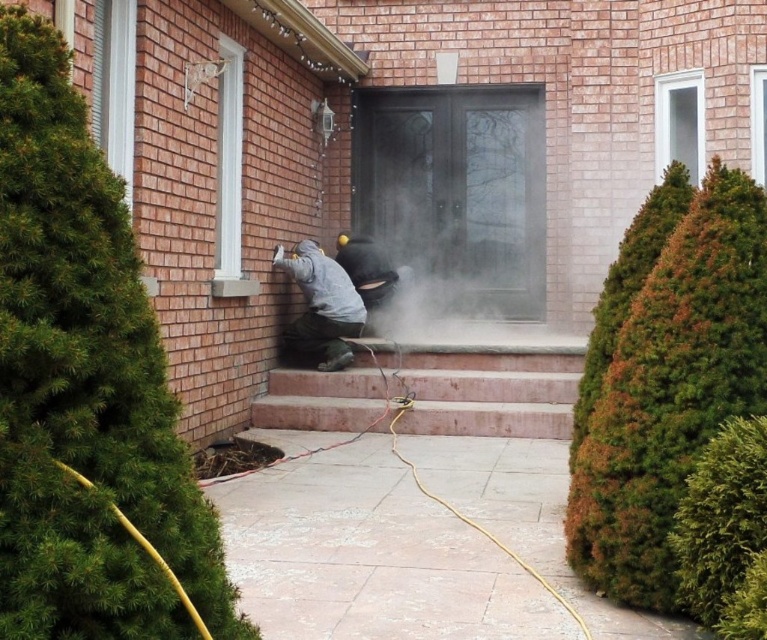
Is point (443, 410) positioned behind point (321, 333)?

No, it is not.

Does pink concrete stairs at center have a smaller size compared to gray matte jacket at center?

Actually, pink concrete stairs at center might be larger than gray matte jacket at center.

Locate an element on the screen. The image size is (767, 640). pink concrete stairs at center is located at coordinates (433, 392).

What do you see at coordinates (456, 189) in the screenshot? The height and width of the screenshot is (640, 767). I see `smoke-filled glass door at center` at bounding box center [456, 189].

Identify the location of smoke-filled glass door at center. The width and height of the screenshot is (767, 640). (456, 189).

Is point (370, 140) behind point (310, 284)?

Yes.

The image size is (767, 640). In order to click on smoke-filled glass door at center in this screenshot , I will do `click(456, 189)`.

Image resolution: width=767 pixels, height=640 pixels. What do you see at coordinates (456, 189) in the screenshot?
I see `smoke-filled glass door at center` at bounding box center [456, 189].

Is smoke-filled glass door at center to the right of pink concrete stairs at center from the viewer's perspective?

Indeed, smoke-filled glass door at center is positioned on the right side of pink concrete stairs at center.

Which is behind, point (499, 305) or point (565, 358)?

Positioned behind is point (499, 305).

Image resolution: width=767 pixels, height=640 pixels. I want to click on smoke-filled glass door at center, so click(x=456, y=189).